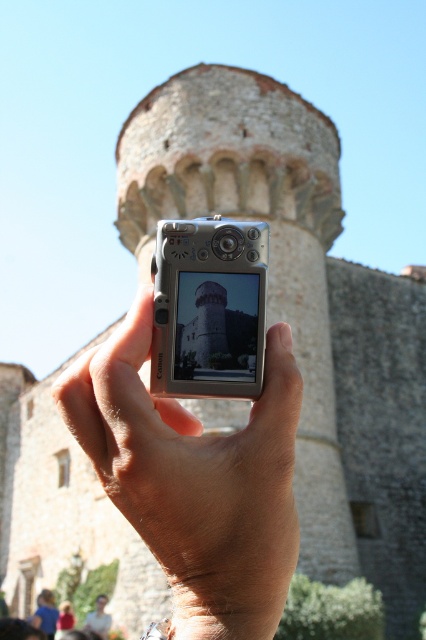
Is smooth skin hand at center above silver metallic camera at center?

No, smooth skin hand at center is not above silver metallic camera at center.

Does point (140, 497) come closer to viewer compared to point (249, 294)?

Yes, point (140, 497) is in front of point (249, 294).

Locate an element on the screen. The height and width of the screenshot is (640, 426). smooth skin hand at center is located at coordinates (195, 480).